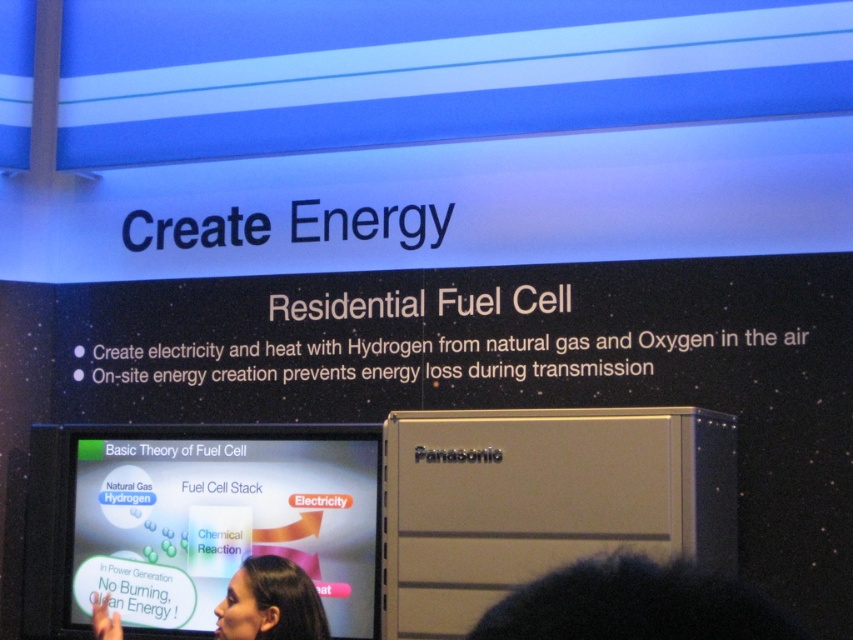
Does matte white screen at center have a smaller size compared to smooth skin face at lower center?

No.

Does matte white screen at center have a lesser width compared to smooth skin face at lower center?

Incorrect, matte white screen at center's width is not less than smooth skin face at lower center's.

This screenshot has width=853, height=640. I want to click on matte white screen at center, so 221,520.